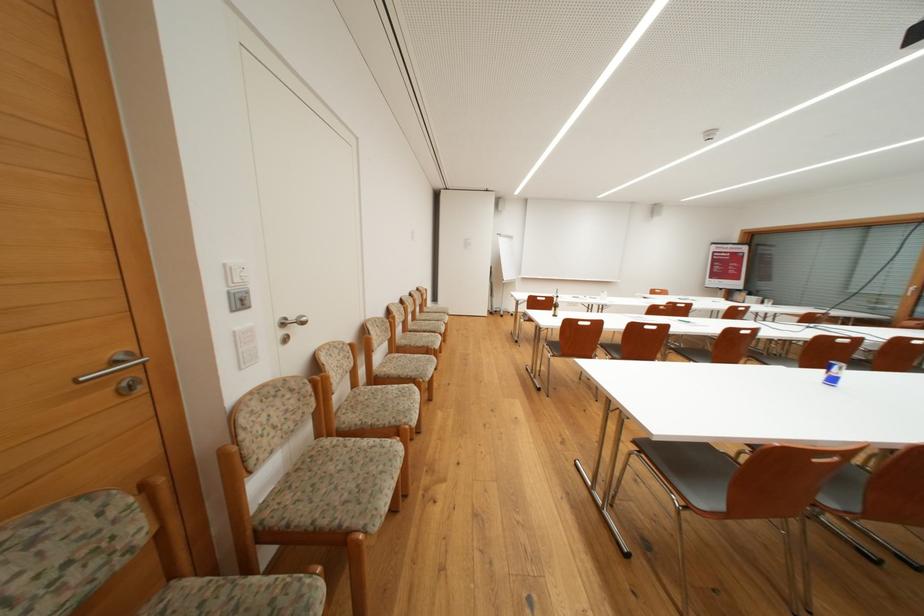
Describe the element at coordinates (238, 299) in the screenshot. This screenshot has height=616, width=924. I see `the silver light switch` at that location.